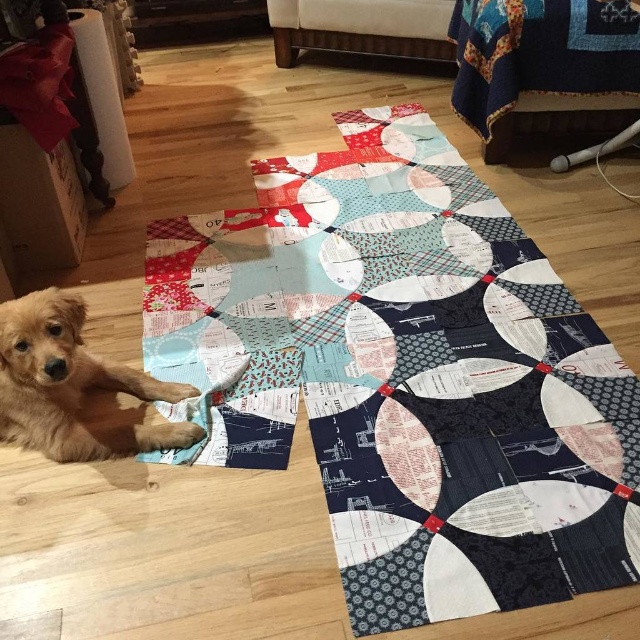
Question: Which point appears farthest from the camera in this image?

Choices:
 (A) (460, 212)
 (B) (56, 387)

Answer: (A)

Question: Does patchwork quilt at center appear over golden fur dog at lower left?

Choices:
 (A) yes
 (B) no

Answer: (A)

Question: Does patchwork quilt at center appear under golden fur dog at lower left?

Choices:
 (A) yes
 (B) no

Answer: (B)

Question: In this image, where is patchwork quilt at center located relative to golden fur dog at lower left?

Choices:
 (A) below
 (B) above

Answer: (B)

Question: Which of the following is the farthest from the observer?

Choices:
 (A) golden fur dog at lower left
 (B) patchwork quilt at center

Answer: (A)

Question: Which point is closer to the camera?

Choices:
 (A) (228, 310)
 (B) (24, 412)

Answer: (B)